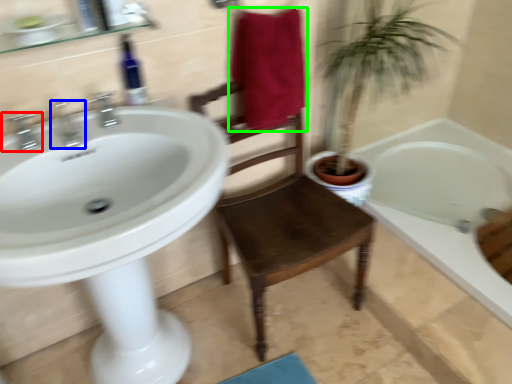
Question: Based on their relative distances, which object is farther from tap (highlighted by a red box)? Choose from tap (highlighted by a blue box) and bath towel (highlighted by a green box).

Choices:
 (A) tap
 (B) bath towel

Answer: (B)